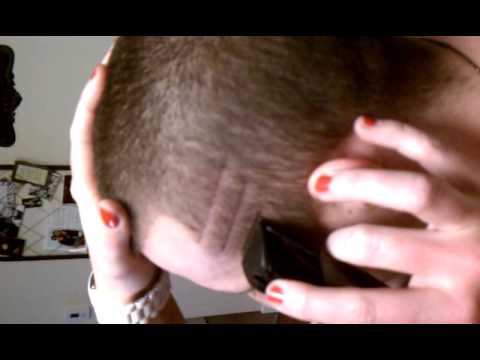
Where is `wall`? This screenshot has width=480, height=360. wall is located at coordinates (55, 120).